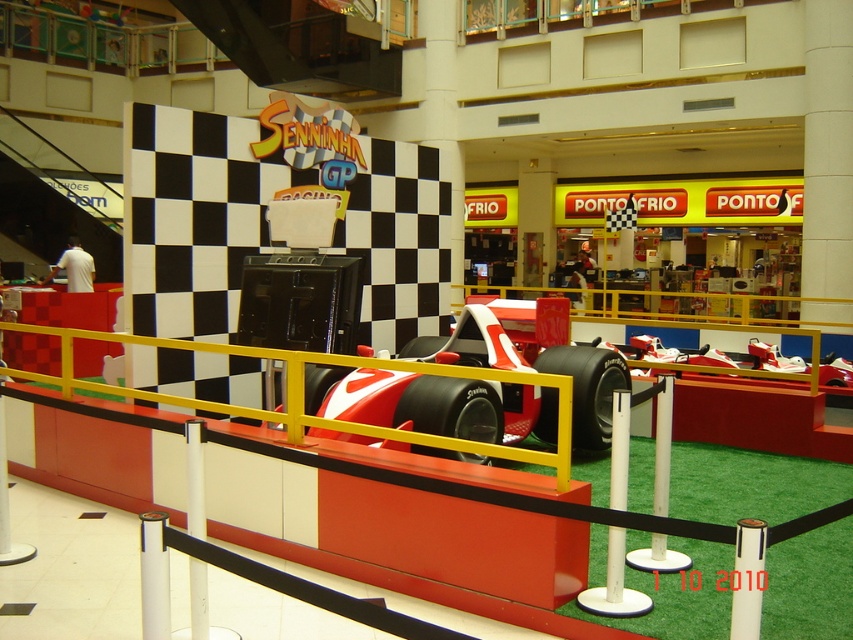
You are a visitor at the mall and want to take a photo with the red matte race car at center. There is a white plastic pole at center blocking your path. Can you walk around the pole to get to the car?

The red matte race car at center is to the right of the white plastic pole at center, so you can walk around the pole to the right side to reach the car.

What is located at the coordinates point (439, 404) in the image?

The red matte race car at center is located at point (439, 404).

You are standing in front of the Formula One car exhibit and want to take a photo. You have two points marked on your camera screen at coordinates point (483, 314) and point (206, 525). Which point is closer to you?

Point (206, 525) is closer to you because it is nearer to the camera than point (483, 314).